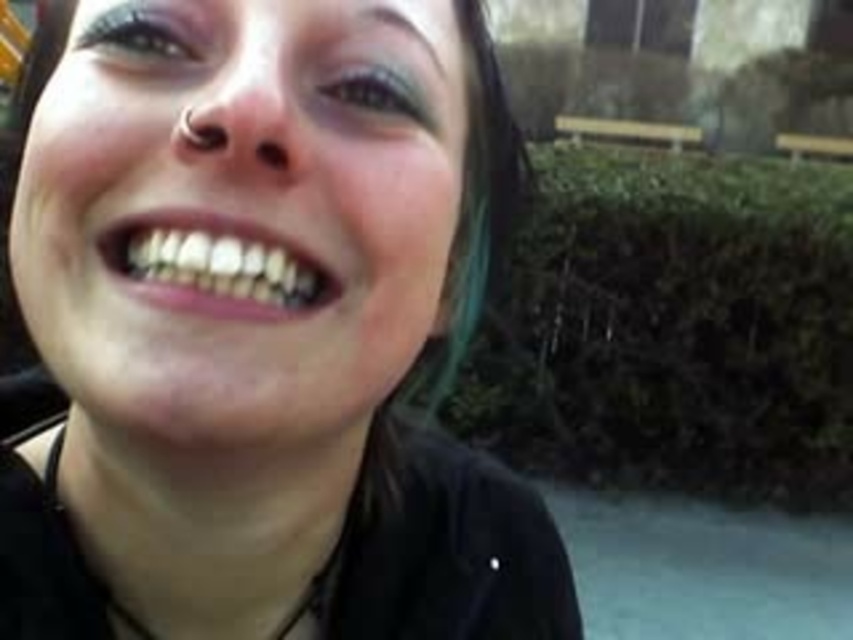
Does matte black face at center lie behind matte purple eye at upper left?

No, it is not.

Find the location of a particular element. The height and width of the screenshot is (640, 853). matte black face at center is located at coordinates (16, 332).

Where is `matte black face at center`? matte black face at center is located at coordinates (16, 332).

Is point (151, 20) positioned in front of point (397, 86)?

Yes, it is.

Between matte purple eye at upper left and green matte eye at upper center, which one has more height?

With more height is matte purple eye at upper left.

Is point (109, 36) farther from camera compared to point (375, 106)?

No, it is in front of (375, 106).

Where is `matte purple eye at upper left`? matte purple eye at upper left is located at coordinates (143, 32).

Is matte black face at center closer to the viewer compared to green matte eye at upper center?

Yes, it is in front of green matte eye at upper center.

Is matte black face at center below green matte eye at upper center?

No.

Is point (473, 275) less distant than point (428, 120)?

No, it is behind (428, 120).

The width and height of the screenshot is (853, 640). Identify the location of matte black face at center. (16, 332).